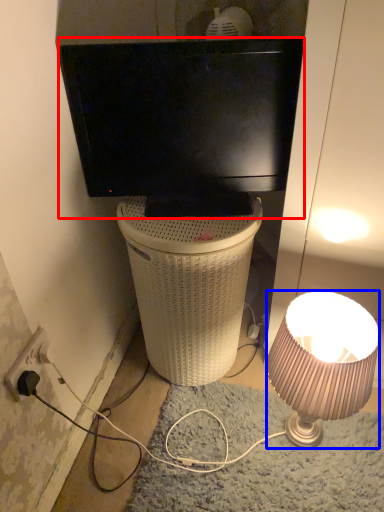
Question: Among these objects, which one is farthest to the camera, television (highlighted by a red box) or lamp (highlighted by a blue box)?

Choices:
 (A) television
 (B) lamp

Answer: (A)